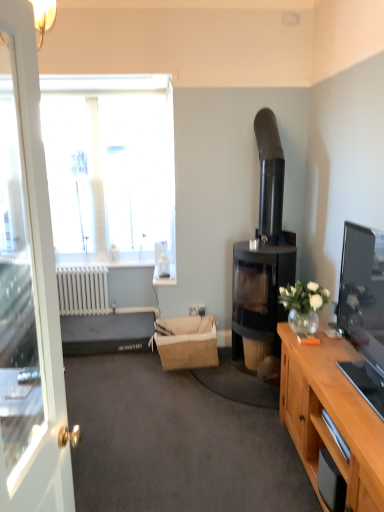
Identify the location of free space above dark gray fabric bed at lower left (from a real-world perspective). (108, 323).